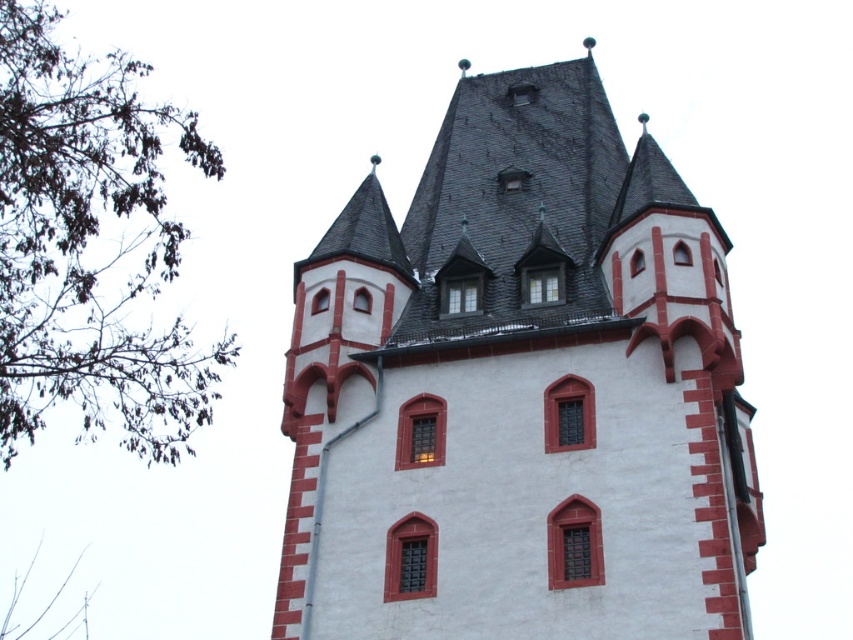
Which is more to the right, white stucco tower at center or green leafy branches at left?

white stucco tower at center is more to the right.

Between white stucco tower at center and green leafy branches at left, which one has less height?

white stucco tower at center is shorter.

Is point (412, 579) closer to camera compared to point (189, 131)?

Yes, it is.

You are a GUI agent. You are given a task and a screenshot of the screen. Output one action in this format:
    pyautogui.click(x=<x>, y=<y>)
    Task: Click on the white stucco tower at center
    This screenshot has width=853, height=640.
    Given the screenshot: What is the action you would take?
    pyautogui.click(x=519, y=392)